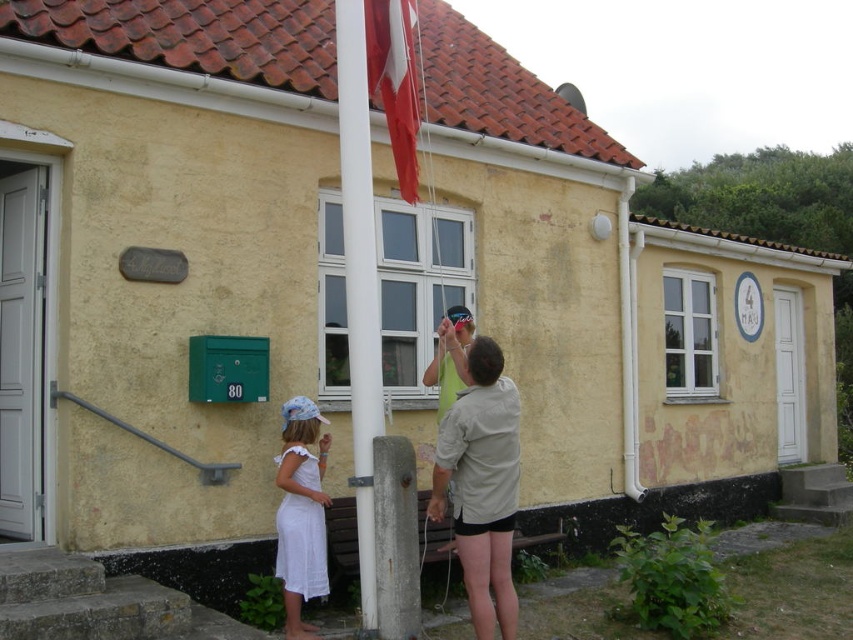
Question: Is light beige shirt at center closer to camera compared to green fabric shirt at center?

Choices:
 (A) yes
 (B) no

Answer: (A)

Question: Does white cotton dress at lower left have a lesser width compared to red fabric flag at upper center?

Choices:
 (A) no
 (B) yes

Answer: (B)

Question: Which object is positioned farthest from the green fabric shirt at center?

Choices:
 (A) light beige shirt at center
 (B) white plastic pole at center
 (C) red fabric flag at upper center
 (D) white cotton dress at lower left

Answer: (C)

Question: Is white cotton dress at lower left to the right of green fabric shirt at center from the viewer's perspective?

Choices:
 (A) no
 (B) yes

Answer: (A)

Question: Based on their relative distances, which object is nearer to the light beige shirt at center?

Choices:
 (A) red fabric flag at upper center
 (B) white plastic pole at center
 (C) white cotton dress at lower left

Answer: (B)

Question: Among these points, which one is nearest to the camera?

Choices:
 (A) (351, 317)
 (B) (439, 344)
 (C) (511, 481)
 (D) (416, 170)

Answer: (C)